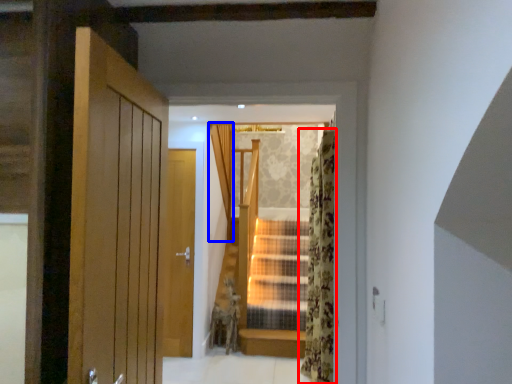
Question: Which object appears closest to the camera in this image, curtain (highlighted by a red box) or curtain (highlighted by a blue box)?

Choices:
 (A) curtain
 (B) curtain

Answer: (A)